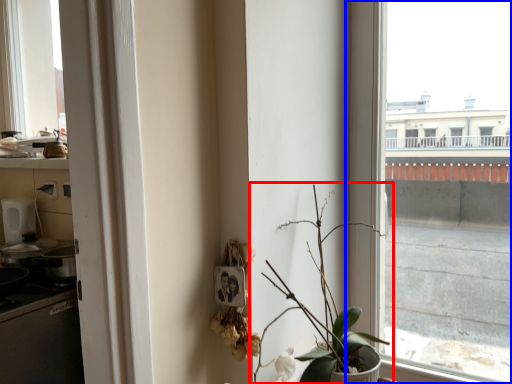
Question: Which of the following is the farthest to the observer, houseplant (highlighted by a red box) or window (highlighted by a blue box)?

Choices:
 (A) houseplant
 (B) window

Answer: (B)